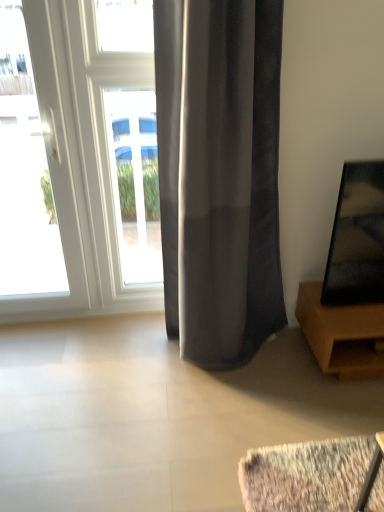
The height and width of the screenshot is (512, 384). Identify the location of free space to the right of white glossy door at left. (98, 335).